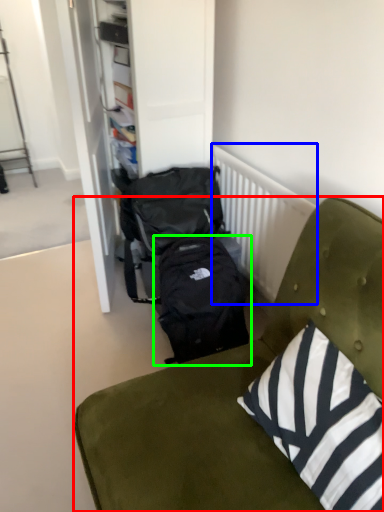
Question: Considering the real-world distances, which object is farthest from furniture (highlighted by a red box)? radiator (highlighted by a blue box) or backpack (highlighted by a green box)?

Choices:
 (A) radiator
 (B) backpack

Answer: (A)